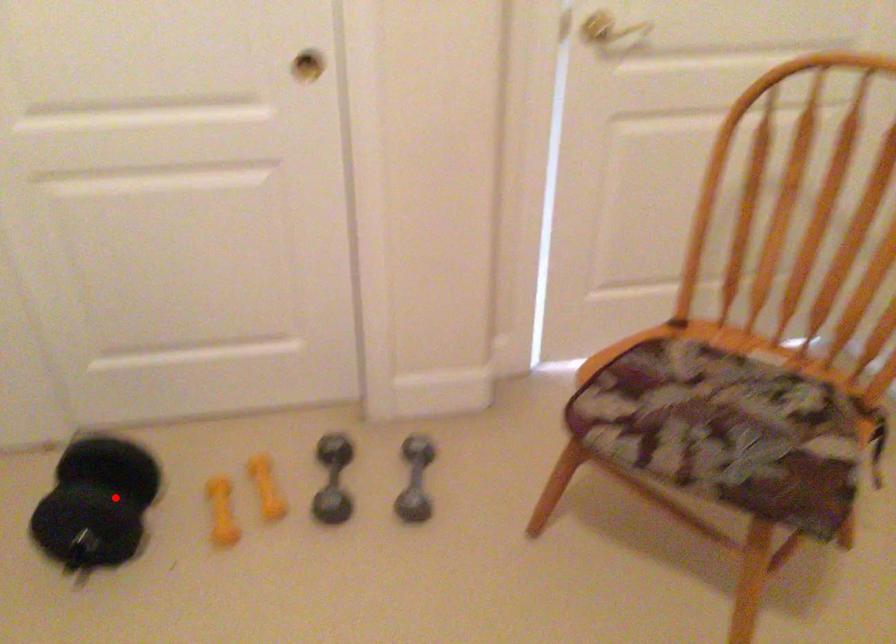
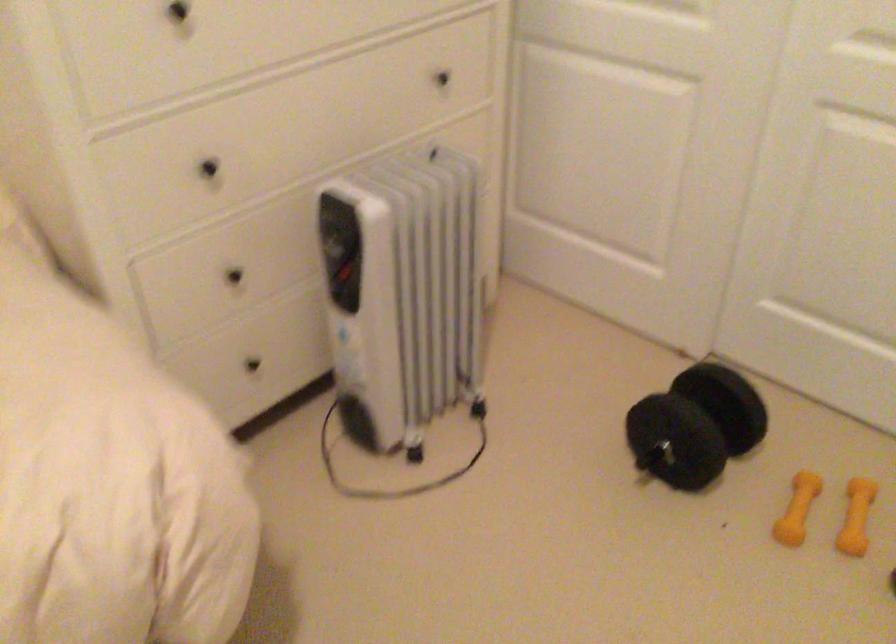
In the second image, find the point that corresponds to the highlighted location in the first image.

(695, 426)